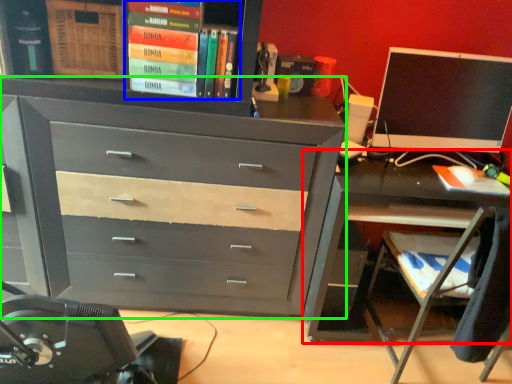
Question: Based on their relative distances, which object is farther from desk (highlighted by a red box)? Choose from book (highlighted by a blue box) and chest of drawers (highlighted by a green box).

Choices:
 (A) book
 (B) chest of drawers

Answer: (A)